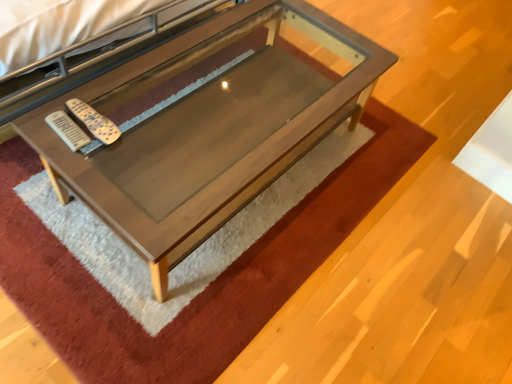
Question: Is white plastic remote at center-left, placed as the 1th remote when sorted from right to left, wider or thinner than wooden table at center?

Choices:
 (A) wide
 (B) thin

Answer: (B)

Question: Based on their sizes in the image, would you say white plastic remote at center-left, placed as the 1th remote when sorted from right to left, is bigger or smaller than wooden table at center?

Choices:
 (A) big
 (B) small

Answer: (B)

Question: Considering the real-world distances, which object is closest to the wooden table at center?

Choices:
 (A) white plastic remote at center-left, placed as the 1th remote when sorted from right to left
 (B) white plastic remote at left, marked as the second remote in a right-to-left arrangement

Answer: (A)

Question: Based on their relative distances, which object is nearer to the wooden table at center?

Choices:
 (A) white plastic remote at left, marked as the second remote in a right-to-left arrangement
 (B) white plastic remote at center-left, placed as the 1th remote when sorted from right to left

Answer: (B)